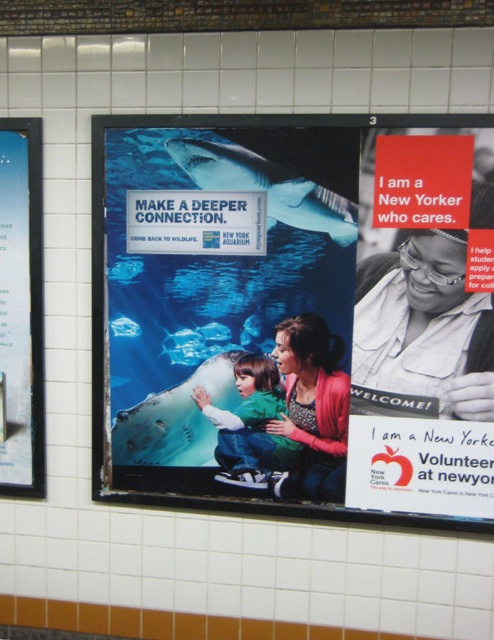
Image resolution: width=494 pixels, height=640 pixels. What do you see at coordinates (293, 314) in the screenshot? I see `matte blue poster at center` at bounding box center [293, 314].

Who is more forward, (271, 365) or (23, 298)?

Point (271, 365) is in front.

Which is behind, point (169, 356) or point (21, 396)?

The point (21, 396) is more distant.

Locate an element on the screen. The image size is (494, 640). matte blue poster at center is located at coordinates (293, 314).

Between white shirt at upper right and matte glass window at left, which one appears on the left side from the viewer's perspective?

Positioned to the left is matte glass window at left.

Can you confirm if white shirt at upper right is positioned to the right of matte glass window at left?

Yes, white shirt at upper right is to the right of matte glass window at left.

Find the location of a particular element. This screenshot has height=640, width=494. white shirt at upper right is located at coordinates (421, 324).

Find the location of a particular element. white shirt at upper right is located at coordinates (421, 324).

Between point (348, 216) and point (205, 397), which one is positioned behind?

Positioned behind is point (205, 397).

Measure the distance between matte blue poster at center and green cotton shirt at center.

The distance of matte blue poster at center from green cotton shirt at center is 10.09 inches.

Identify the location of matte blue poster at center. (293, 314).